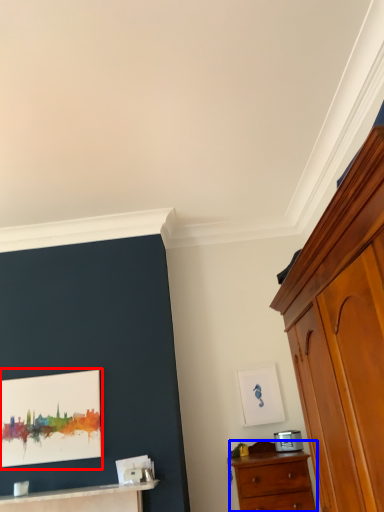
Question: Among these objects, which one is nearest to the camera, picture frame (highlighted by a red box) or chest of drawers (highlighted by a blue box)?

Choices:
 (A) picture frame
 (B) chest of drawers

Answer: (B)